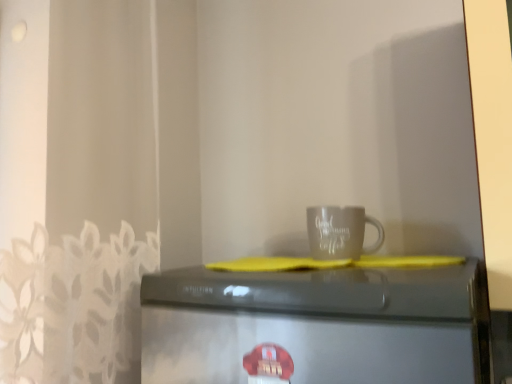
Measure the distance between matte gray mug at center and camera.

matte gray mug at center and camera are 37.40 inches apart.

This screenshot has width=512, height=384. Find the location of `matte gray mug at center`. matte gray mug at center is located at coordinates (340, 232).

Describe the element at coordinates (340, 232) in the screenshot. The height and width of the screenshot is (384, 512). I see `matte gray mug at center` at that location.

Find the location of a particular element. matte gray mug at center is located at coordinates (340, 232).